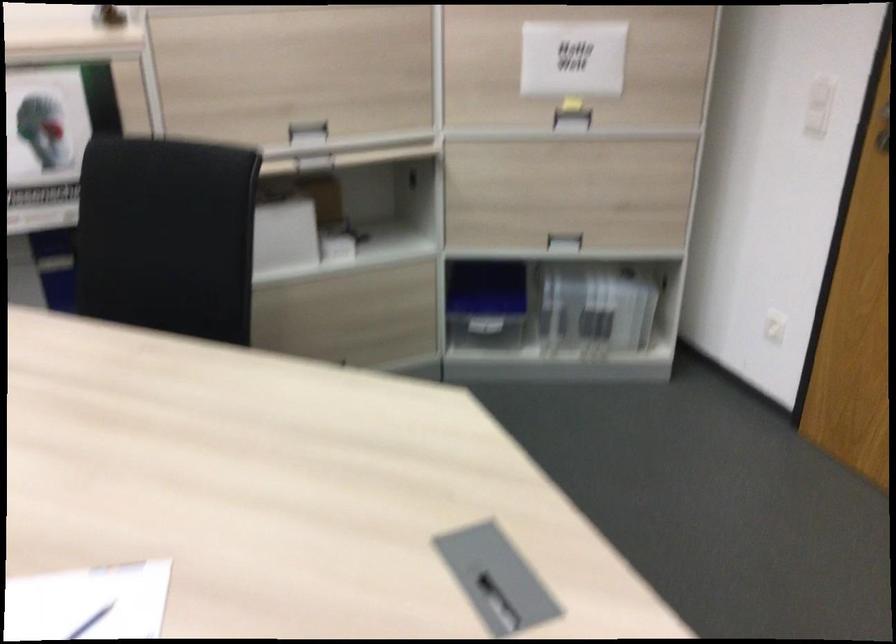
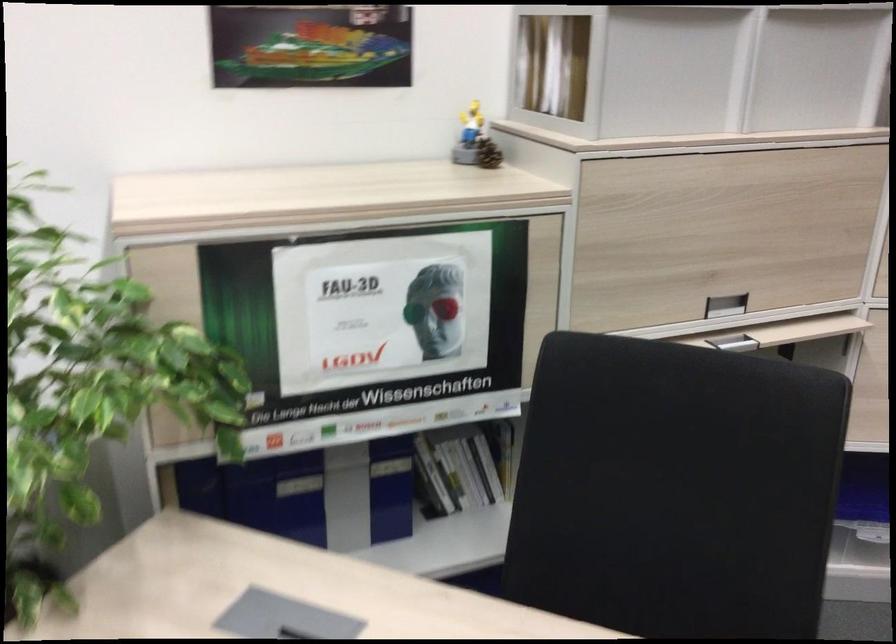
What movement of the cameraman would produce the second image?

The movement direction of the cameraman is left, forward.